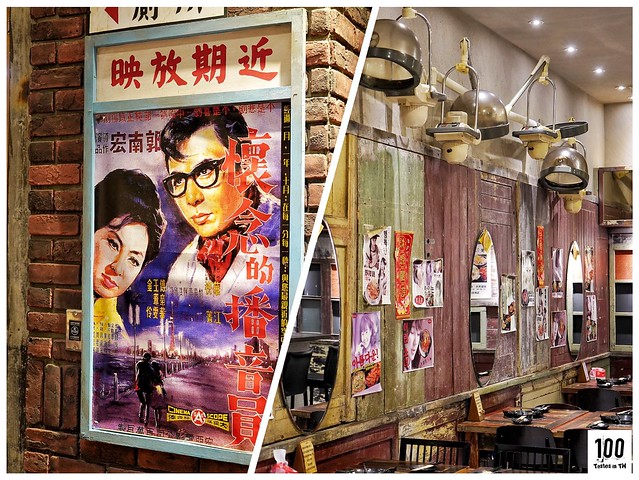
Image resolution: width=639 pixels, height=480 pixels. What are the coordinates of `3 hairdryers` in the screenshot? It's located at (381, 63), (486, 109), (583, 171).